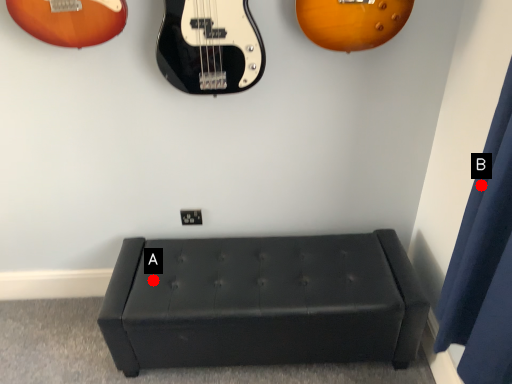
Question: Two points are circled on the image, labeled by A and B beside each circle. Which point is closer to the camera taking this photo?

Choices:
 (A) A is closer
 (B) B is closer

Answer: (B)